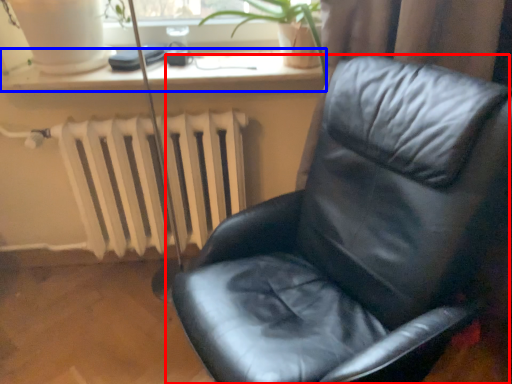
Question: Which object appears farthest to the camera in this image, chair (highlighted by a red box) or window sill (highlighted by a blue box)?

Choices:
 (A) chair
 (B) window sill

Answer: (B)